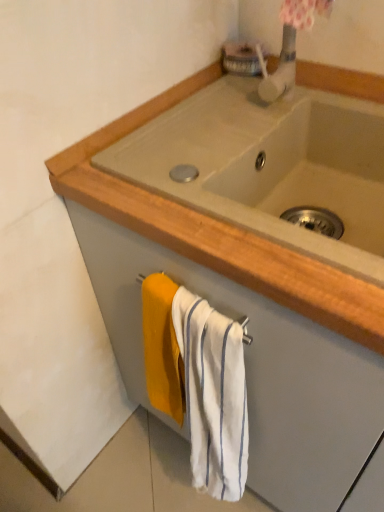
At what (x,y) coordinates should I click in order to perform the action: click on vacant space situated above beige ceramic sink at center (from a real-world perspective). Please return your answer as a coordinate pair (x, y). The width and height of the screenshot is (384, 512). Looking at the image, I should click on (215, 122).